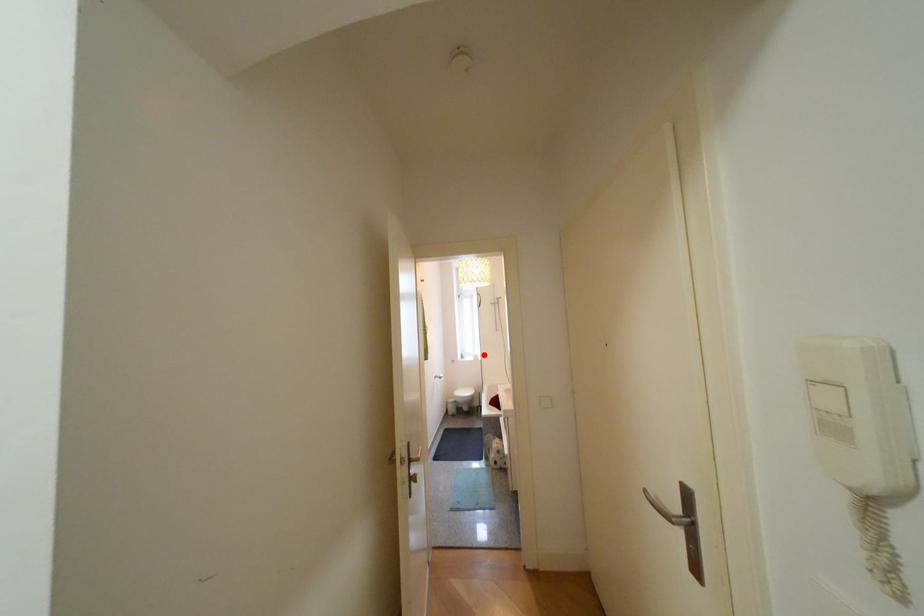
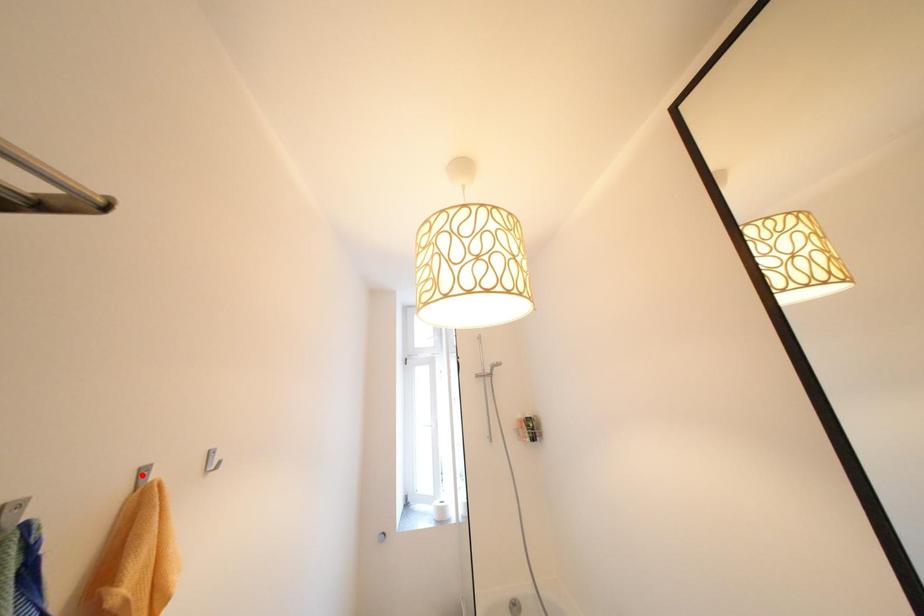
I am providing you with two images of the same scene from different viewpoints. A red point is marked on the first image and another point is marked on the second image. Does the point marked in image1 correspond to the same location as the one in image2?

No